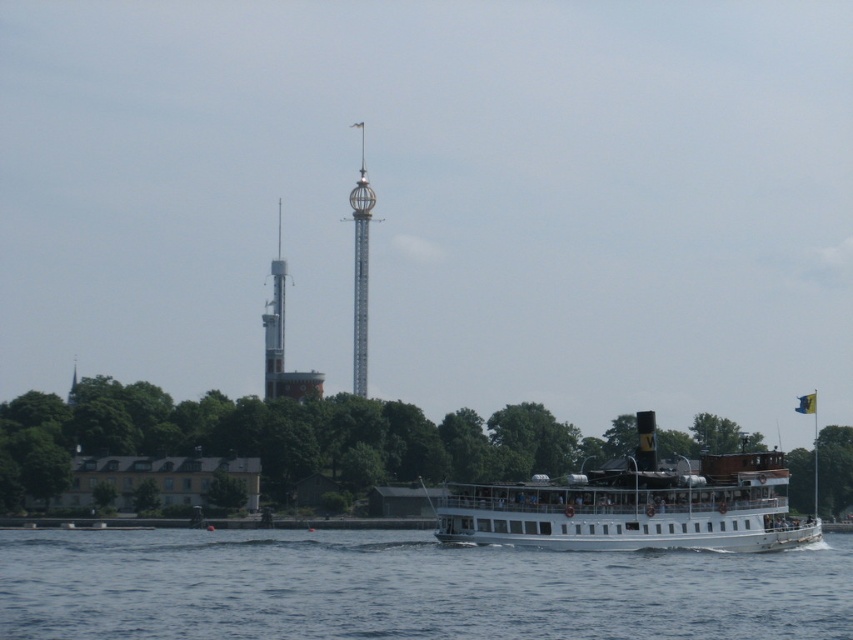
Question: Is white smooth water at lower center below white metallic tower at center?

Choices:
 (A) yes
 (B) no

Answer: (A)

Question: Among these points, which one is farthest from the camera?

Choices:
 (A) (809, 532)
 (B) (360, 380)
 (C) (363, 632)

Answer: (B)

Question: Which point is closer to the camera taking this photo?

Choices:
 (A) (276, 362)
 (B) (361, 131)
 (C) (695, 540)
 (D) (397, 566)

Answer: (C)

Question: Is white matte steamboat at center to the left of silver metallic tower at center from the viewer's perspective?

Choices:
 (A) no
 (B) yes

Answer: (A)

Question: Which point appears farthest from the camera in this image?

Choices:
 (A) (293, 394)
 (B) (93, 413)

Answer: (A)

Question: Observing the image, what is the correct spatial positioning of white smooth water at lower center in reference to white matte steamboat at center?

Choices:
 (A) right
 (B) left

Answer: (B)